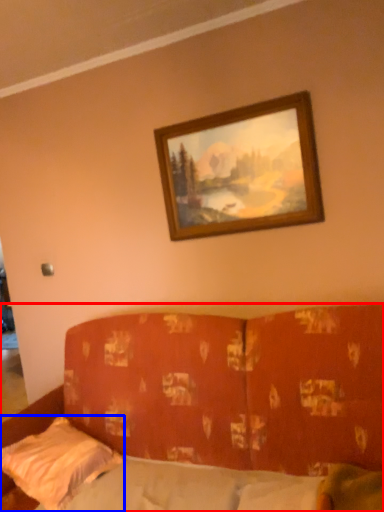
Question: Which point is closer to the camera, studio couch (highlighted by a red box) or pillow (highlighted by a blue box)?

Choices:
 (A) studio couch
 (B) pillow

Answer: (A)